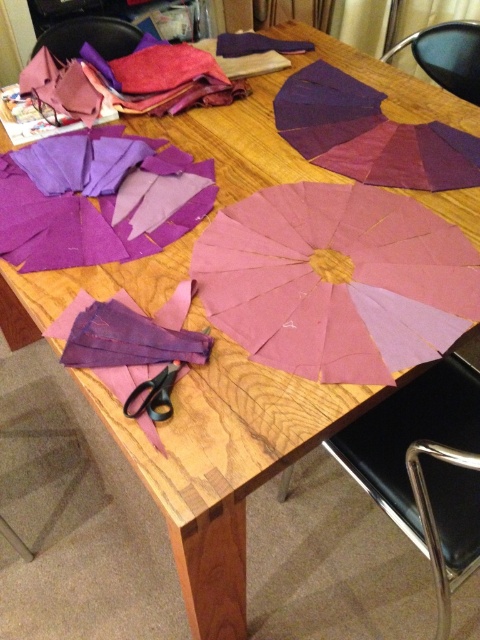
You are a person sitting on a chair in the image. You need to reach for the black plastic chair at upper right to adjust its position. Considering your arm length is 0.7 meters, can you reach it without moving from your current position?

The black plastic chair at upper right is 1.52 meters away from the camera. Since your arm length is only 0.7 meters, you cannot reach the black plastic chair at upper right without moving from your current position.

You are organizing a crafting workshop and need to place a decorative centerpiece on the table. The centerpiece requires a space wider than the black plastic scissors at lower left. Can the black plastic chair at upper right provide enough width for this centerpiece?

The black plastic chair at upper right has a larger width than the black plastic scissors at lower left, so it can provide enough space for the centerpiece that requires a width larger than the scissors.